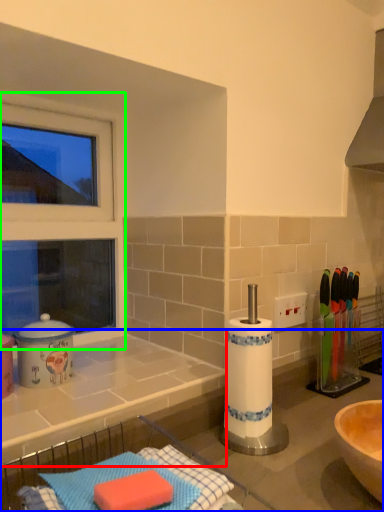
Question: Based on their relative distances, which object is farther from countertop (highlighted by a red box)? Choose from countertop (highlighted by a blue box) and window frame (highlighted by a green box).

Choices:
 (A) countertop
 (B) window frame

Answer: (B)